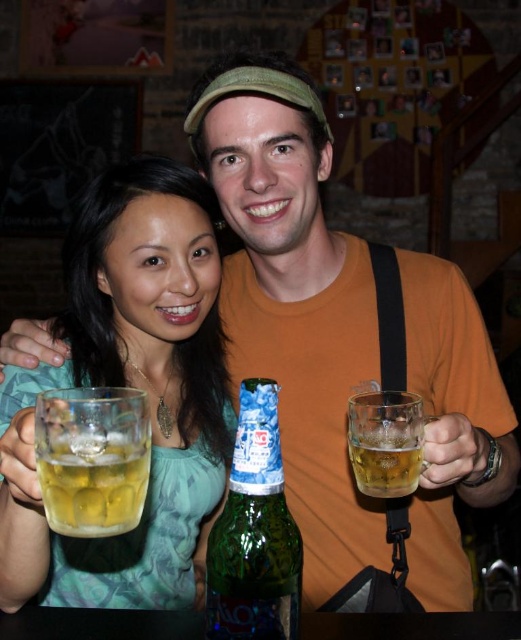
Find the location of a particular element. This screenshot has height=640, width=521. green glass bottle at center is located at coordinates (254, 532).

Is point (219, 589) less distant than point (405, 416)?

That is True.

You are a GUI agent. You are given a task and a screenshot of the screen. Output one action in this format:
    pyautogui.click(x=<x>, y=<y>)
    Task: Click on the green glass bottle at center
    This screenshot has width=521, height=640.
    Given the screenshot: What is the action you would take?
    pyautogui.click(x=254, y=532)

Image resolution: width=521 pixels, height=640 pixels. Find the location of `green glass bottle at center`. green glass bottle at center is located at coordinates (254, 532).

Which is behind, point (137, 397) or point (359, 484)?

Positioned behind is point (359, 484).

Is translucent glass mug at lower left further to camera compared to translucent glass mug at right?

That is False.

Between point (59, 493) and point (367, 492), which one is positioned behind?

Positioned behind is point (367, 492).

This screenshot has height=640, width=521. I want to click on translucent glass mug at lower left, so click(93, 458).

Is point (254, 573) less distant than point (133, 420)?

That is True.

Who is positioned more to the left, green glass bottle at center or translucent glass mug at lower left?

translucent glass mug at lower left

Who is more forward, [256,540] or [91,488]?

Point [91,488]

Identify the location of green glass bottle at center. (254, 532).